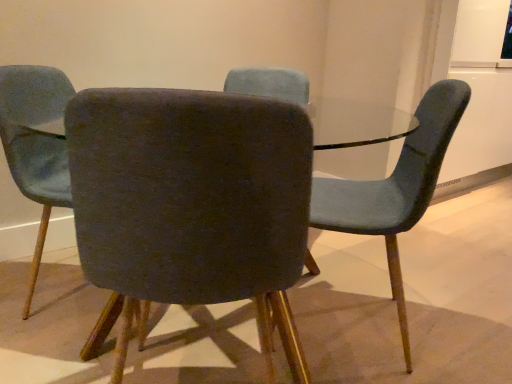
What do you see at coordinates (396, 187) in the screenshot?
I see `velvet teal chair at right, acting as the 1th chair starting from the right` at bounding box center [396, 187].

Find the location of a particular element. The height and width of the screenshot is (384, 512). velvet teal chair at right, acting as the 1th chair starting from the right is located at coordinates (396, 187).

How different are the orientations of velvet dark gray chair at center, the second chair from the left, and velvet teal chair at right, the third chair from the left, in degrees?

The angular difference between velvet dark gray chair at center, the second chair from the left, and velvet teal chair at right, the third chair from the left, is 73 degrees.

Measure the distance between velvet dark gray chair at center, the second chair from the left, and velvet teal chair at right, the third chair from the left.

They are 22.32 inches apart.

In the image, is velvet dark gray chair at center, acting as the 2th chair starting from the right, positioned in front of or behind velvet teal chair at right, acting as the 1th chair starting from the right?

velvet dark gray chair at center, acting as the 2th chair starting from the right, is positioned closer to the viewer than velvet teal chair at right, acting as the 1th chair starting from the right.

Is there a large distance between velvet dark gray chair at center, acting as the 2th chair starting from the right, and velvet teal chair at right, the third chair from the left?

They are positioned close to each other.

Considering the positions of objects velvet dark gray chair at center, which appears as the third chair when viewed from the right, and velvet teal chair at right, the third chair from the left, in the image provided, who is more to the left, velvet dark gray chair at center, which appears as the third chair when viewed from the right, or velvet teal chair at right, the third chair from the left,?

Positioned to the left is velvet dark gray chair at center, which appears as the third chair when viewed from the right.

Is velvet teal chair at right, the third chair from the left, at the back of velvet dark gray chair at center, which appears as the third chair when viewed from the right?

velvet dark gray chair at center, which appears as the third chair when viewed from the right, does not have its back to velvet teal chair at right, the third chair from the left.

In order to click on the 2nd chair below the velvet dark gray chair at center, which appears as the third chair when viewed from the right (from a real-world perspective) in this screenshot , I will do `click(396, 187)`.

Does point (64, 165) come in front of point (399, 187)?

That is False.

Does point (141, 251) come behind point (24, 142)?

No, (141, 251) is in front of (24, 142).

Is velvet dark gray chair at center, which appears as the third chair when viewed from the right, completely or partially inside velvet dark gray chair at center, acting as the 2th chair starting from the right?

No, velvet dark gray chair at center, which appears as the third chair when viewed from the right, is not a part of velvet dark gray chair at center, acting as the 2th chair starting from the right.

In terms of height, does velvet dark gray chair at center, the second chair from the left, look taller or shorter compared to velvet dark gray chair at center, marked as the 1th chair in a left-to-right arrangement?

In the image, velvet dark gray chair at center, the second chair from the left, appears to be shorter than velvet dark gray chair at center, marked as the 1th chair in a left-to-right arrangement.

Consider the image. From the image's perspective, who appears lower, velvet dark gray chair at center, acting as the 2th chair starting from the right, or velvet dark gray chair at center, which appears as the third chair when viewed from the right?

velvet dark gray chair at center, acting as the 2th chair starting from the right, appears lower in the image.

Consider the image. Which is more to the left, velvet teal chair at right, acting as the 1th chair starting from the right, or velvet dark gray chair at center, which appears as the third chair when viewed from the right?

velvet dark gray chair at center, which appears as the third chair when viewed from the right.

From a real-world perspective, does velvet teal chair at right, the third chair from the left, stand above velvet dark gray chair at center, marked as the 1th chair in a left-to-right arrangement?

No, from a real-world perspective, velvet teal chair at right, the third chair from the left, is not over velvet dark gray chair at center, marked as the 1th chair in a left-to-right arrangement

Is velvet teal chair at right, the third chair from the left, wider than velvet dark gray chair at center, marked as the 1th chair in a left-to-right arrangement?

Incorrect, the width of velvet teal chair at right, the third chair from the left, does not surpass that of velvet dark gray chair at center, marked as the 1th chair in a left-to-right arrangement.

Considering the sizes of objects velvet teal chair at right, acting as the 1th chair starting from the right, and velvet dark gray chair at center, marked as the 1th chair in a left-to-right arrangement, in the image provided, who is smaller, velvet teal chair at right, acting as the 1th chair starting from the right, or velvet dark gray chair at center, marked as the 1th chair in a left-to-right arrangement,?

velvet teal chair at right, acting as the 1th chair starting from the right, is smaller.

How far apart are velvet dark gray chair at center, marked as the 1th chair in a left-to-right arrangement, and velvet dark gray chair at center, acting as the 2th chair starting from the right?

They are 27.55 inches apart.

Does velvet dark gray chair at center, which appears as the third chair when viewed from the right, turn towards velvet dark gray chair at center, the second chair from the left?

No.

From a real-world perspective, is velvet dark gray chair at center, marked as the 1th chair in a left-to-right arrangement, positioned under velvet dark gray chair at center, the second chair from the left, based on gravity?

Actually, velvet dark gray chair at center, marked as the 1th chair in a left-to-right arrangement, is physically above velvet dark gray chair at center, the second chair from the left, in the real world.

Who is shorter, velvet dark gray chair at center, which appears as the third chair when viewed from the right, or velvet dark gray chair at center, the second chair from the left?

velvet dark gray chair at center, the second chair from the left.

Does velvet teal chair at right, the third chair from the left, have a greater height compared to velvet dark gray chair at center, acting as the 2th chair starting from the right?

No.

From the image's perspective, between velvet teal chair at right, acting as the 1th chair starting from the right, and velvet dark gray chair at center, the second chair from the left, who is located below?

velvet dark gray chair at center, the second chair from the left.

Is velvet dark gray chair at center, acting as the 2th chair starting from the right, completely or partially inside velvet teal chair at right, acting as the 1th chair starting from the right?

Definitely not — velvet dark gray chair at center, acting as the 2th chair starting from the right, is not inside velvet teal chair at right, acting as the 1th chair starting from the right.

Looking at this image, is velvet teal chair at right, the third chair from the left, aimed at velvet dark gray chair at center, acting as the 2th chair starting from the right?

No, velvet teal chair at right, the third chair from the left, is not turned towards velvet dark gray chair at center, acting as the 2th chair starting from the right.

Where is `the 1st chair above the velvet dark gray chair at center, the second chair from the left (from the image's perspective)`? the 1st chair above the velvet dark gray chair at center, the second chair from the left (from the image's perspective) is located at coordinates (396, 187).

Locate an element on the screen. Image resolution: width=512 pixels, height=384 pixels. the 2nd chair to the right of the velvet dark gray chair at center, marked as the 1th chair in a left-to-right arrangement, starting your count from the anchor is located at coordinates (396, 187).

Estimate the real-world distances between objects in this image. Which object is closer to velvet teal chair at right, the third chair from the left, velvet dark gray chair at center, the second chair from the left, or velvet dark gray chair at center, marked as the 1th chair in a left-to-right arrangement?

The object closer to velvet teal chair at right, the third chair from the left, is velvet dark gray chair at center, the second chair from the left.

Which object lies further to the anchor point velvet teal chair at right, acting as the 1th chair starting from the right, velvet dark gray chair at center, marked as the 1th chair in a left-to-right arrangement, or velvet dark gray chair at center, the second chair from the left?

Among the two, velvet dark gray chair at center, marked as the 1th chair in a left-to-right arrangement, is located further to velvet teal chair at right, acting as the 1th chair starting from the right.

From the picture: Estimate the real-world distances between objects in this image. Which object is closer to velvet dark gray chair at center, which appears as the third chair when viewed from the right, velvet dark gray chair at center, acting as the 2th chair starting from the right, or velvet teal chair at right, the third chair from the left?

velvet dark gray chair at center, acting as the 2th chair starting from the right.

When comparing their distances from velvet dark gray chair at center, marked as the 1th chair in a left-to-right arrangement, does velvet teal chair at right, acting as the 1th chair starting from the right, or velvet dark gray chair at center, acting as the 2th chair starting from the right, seem closer?

velvet dark gray chair at center, acting as the 2th chair starting from the right, is closer to velvet dark gray chair at center, marked as the 1th chair in a left-to-right arrangement.

Which object lies further to the anchor point velvet dark gray chair at center, acting as the 2th chair starting from the right, velvet dark gray chair at center, which appears as the third chair when viewed from the right, or velvet teal chair at right, acting as the 1th chair starting from the right?

velvet dark gray chair at center, which appears as the third chair when viewed from the right, is positioned further to the anchor velvet dark gray chair at center, acting as the 2th chair starting from the right.

Based on the photo, looking at the image, which one is located closer to velvet dark gray chair at center, the second chair from the left, velvet teal chair at right, acting as the 1th chair starting from the right, or velvet dark gray chair at center, which appears as the third chair when viewed from the right?

Among the two, velvet teal chair at right, acting as the 1th chair starting from the right, is located nearer to velvet dark gray chair at center, the second chair from the left.

Locate an element on the screen. The width and height of the screenshot is (512, 384). chair between velvet dark gray chair at center, which appears as the third chair when viewed from the right, and velvet teal chair at right, acting as the 1th chair starting from the right, from left to right is located at coordinates (192, 202).